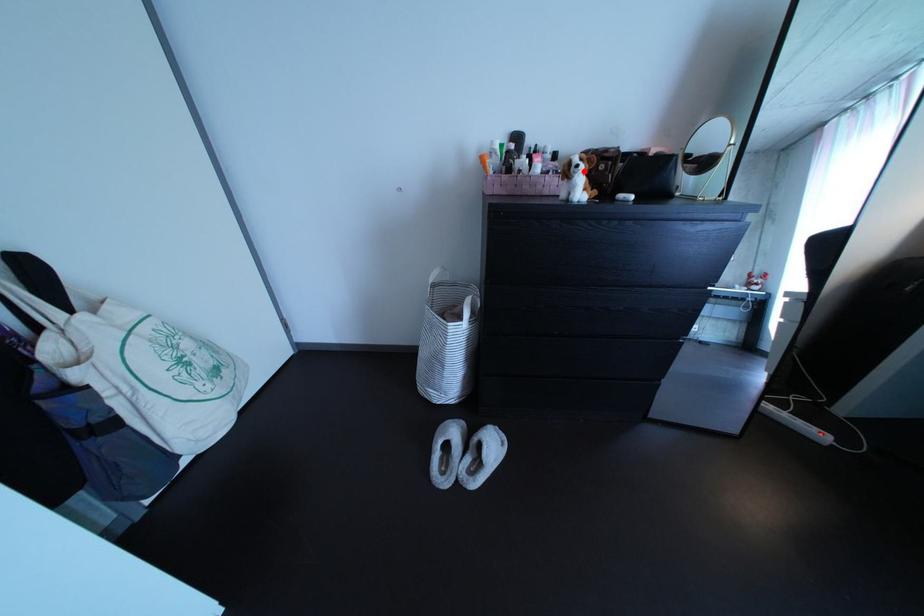
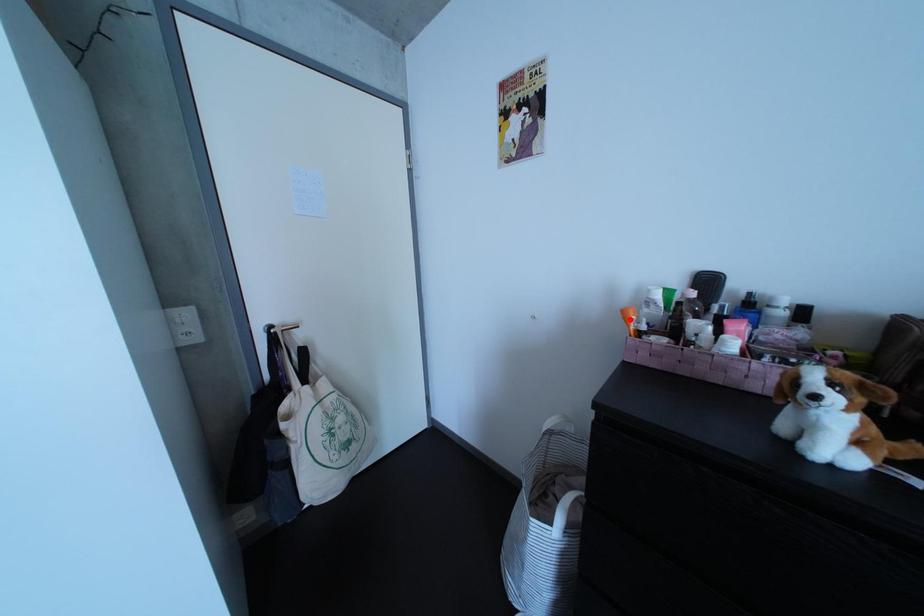
I am providing you with two images of the same scene from different viewpoints. A red point is marked on the first image and another point is marked on the second image. Is the marked point in image1 the same physical position as the marked point in image2?

No